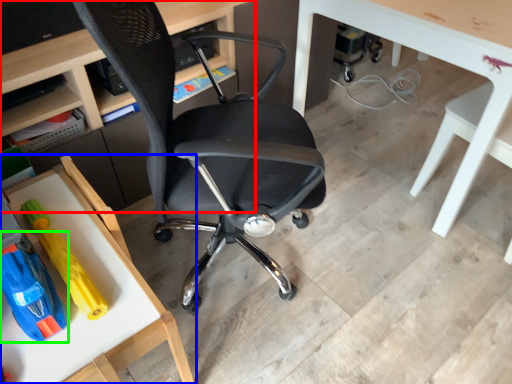
Question: Which object is positioned closest to desk (highlighted by a red box)? Select from table (highlighted by a blue box) and toy (highlighted by a green box).

Choices:
 (A) table
 (B) toy

Answer: (A)